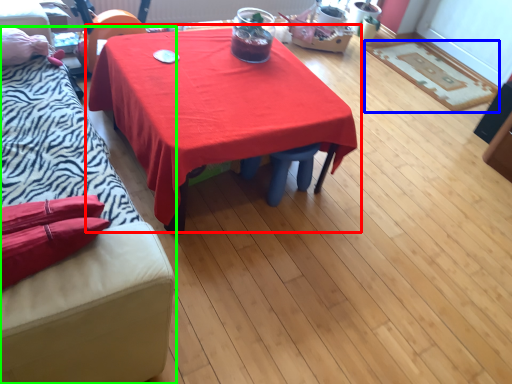
Question: Which is nearer to the table (highlighted by a red box)? mat (highlighted by a blue box) or studio couch (highlighted by a green box).

Choices:
 (A) mat
 (B) studio couch

Answer: (B)